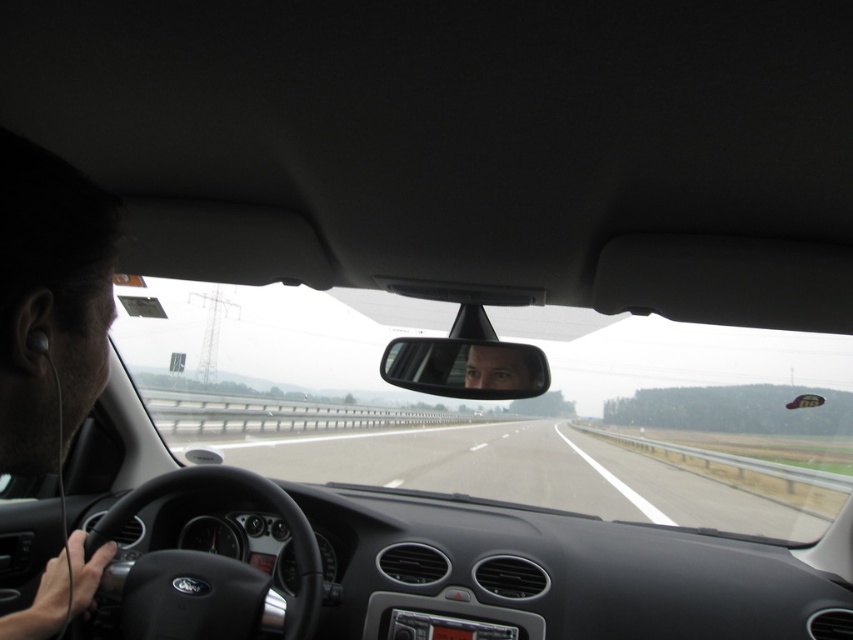
Between transparent glass windshield at center and clear plastic mirror at center, which one has less height?

With less height is clear plastic mirror at center.

Is point (186, 330) positioned behind point (442, 346)?

Yes, point (186, 330) is farther from viewer.

At what (x,y) coordinates should I click in order to perform the action: click on transparent glass windshield at center. Please return your answer as a coordinate pair (x, y). This screenshot has width=853, height=640. Looking at the image, I should click on (505, 410).

Consider the image. Which is more to the right, black matte earphones at left or smooth skin face at center?

Positioned to the right is smooth skin face at center.

Based on the photo, measure the distance between point (65,198) and camera.

Point (65,198) is 88.78 centimeters from camera.

Identify the location of black matte earphones at left. (49, 301).

Can you confirm if transparent glass windshield at center is smaller than smooth skin face at center?

Incorrect, transparent glass windshield at center is not smaller in size than smooth skin face at center.

Does transparent glass windshield at center have a greater width compared to smooth skin face at center?

Correct, the width of transparent glass windshield at center exceeds that of smooth skin face at center.

Is point (283, 433) positioned after point (491, 374)?

Yes.

Where is `transparent glass windshield at center`? transparent glass windshield at center is located at coordinates (505, 410).